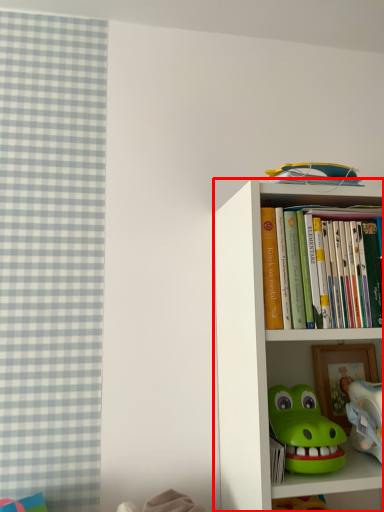
Question: From the image, what is the correct spatial relationship of bookcase (annotated by the red box) in relation to toy?

Choices:
 (A) right
 (B) left

Answer: (B)